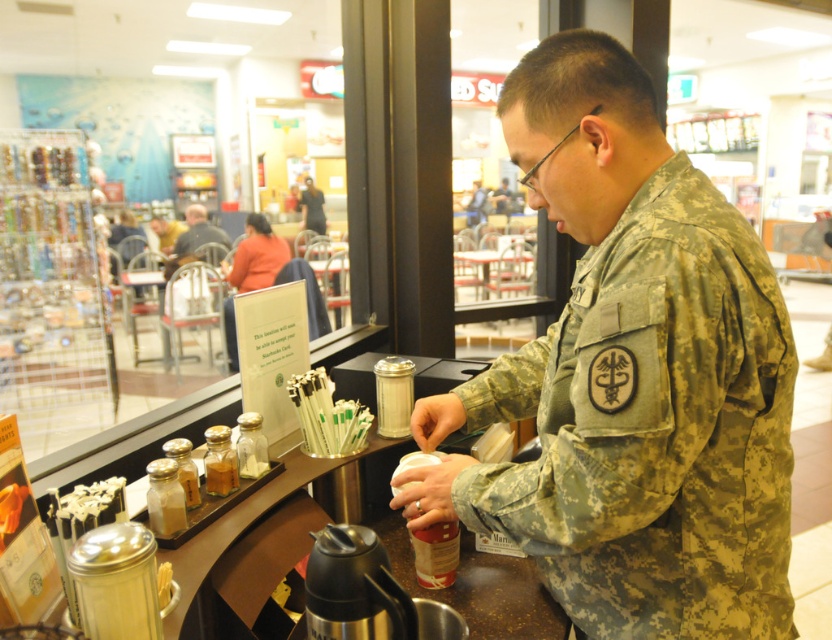
You are a customer in the food court and want to ask the person at the counter for a drink. Which object should you approach first, the blurred skin at center or the camouflage uniform at center?

The blurred skin at center is positioned under camouflage uniform at center, so you should approach the camouflage uniform at center first as it is the visible part of the person.

Wait, the two object labels are the same except for the first word. Maybe there was a mistake in the input. Let me check the original input again. The user provided the Objects as camouflage fabric uniform at center and camouflage uniform at center. The Objects Description says the first is closer. Hmm, perhaps the second object should be another camouflage item? But given the input, I have to work with what I have. The question must include both object labels exactly as given. Since they are slightly named

The camouflage fabric uniform at center is closer to the viewer than the camouflage uniform at center.